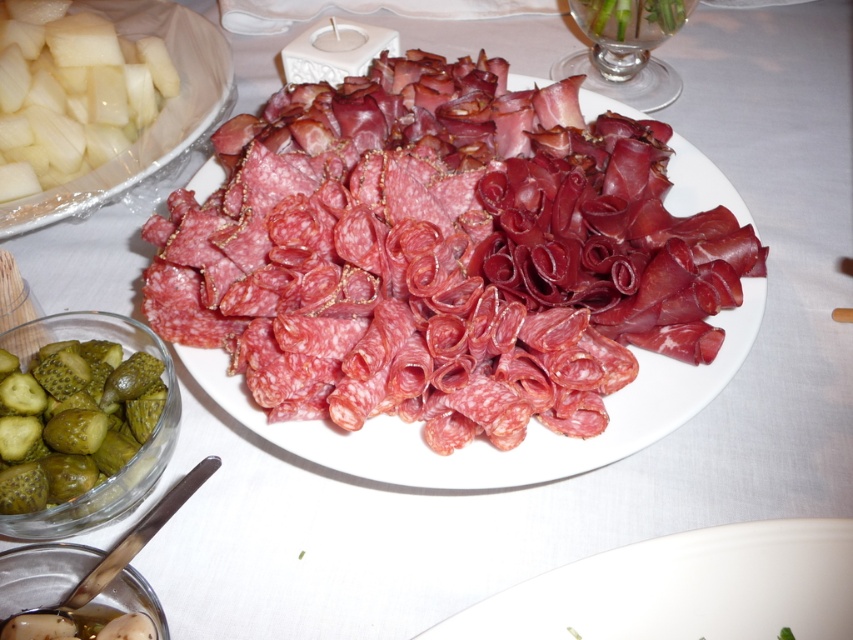
You are holding a knife that is 8 inches long. You want to cut a piece of meat from the platter. Can you reach the point at coordinates point (148, 237) with your knife?

The point (148, 237) is 16.44 inches from the viewer. Since the knife is only 8 inches long, you cannot reach that point with the knife.

You are arranging a picnic basket and want to know if the green pickled cucumber at upper right can fit on the white porcelain plate at lower center. Based on their sizes, can it fit?

The white porcelain plate at lower center might be wider than green pickled cucumber at upper right, so there is a possibility that the cucumber can fit on the plate. However, the exact dimensions are uncertain.

You are a chef arranging a platter for a presentation. You have a white porcelain plate at lower center and sliced salami at center. Which object takes up more area on the table?

The sliced salami at center occupies more space than the white porcelain plate at lower center according to the description.